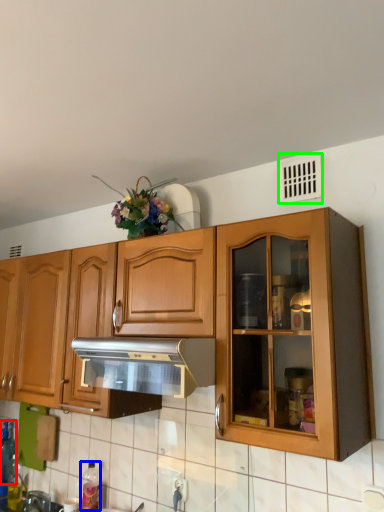
Question: Based on their relative distances, which object is nearer to bottle (highlighted by a red box)? Choose from bottle (highlighted by a blue box) and window (highlighted by a green box).

Choices:
 (A) bottle
 (B) window

Answer: (A)